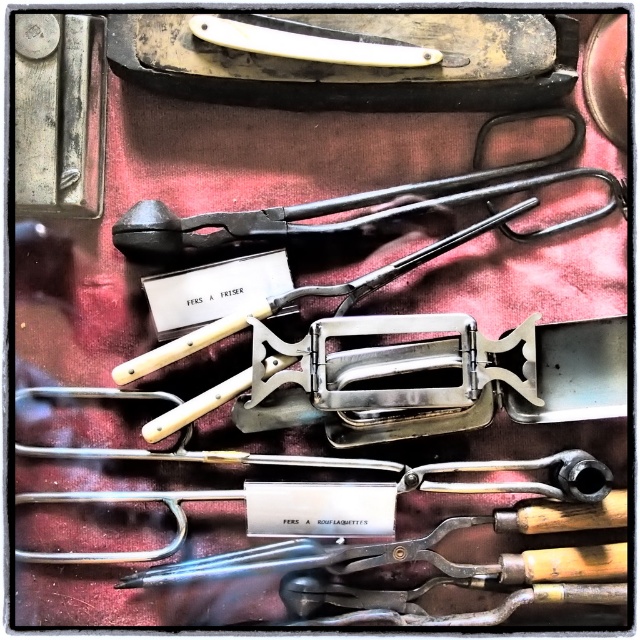
Question: Does black matte tongs at upper center have a lesser width compared to metallic silver tool at center?

Choices:
 (A) yes
 (B) no

Answer: (B)

Question: Which object is closer to the camera taking this photo?

Choices:
 (A) black matte tongs at upper center
 (B) metallic silver tool at center

Answer: (A)

Question: Is black matte tongs at upper center below white plastic straight razor at upper center?

Choices:
 (A) yes
 (B) no

Answer: (A)

Question: Can you confirm if white plastic straight razor at upper center is smaller than metallic silver tool at center?

Choices:
 (A) no
 (B) yes

Answer: (B)

Question: Considering the real-world distances, which object is farthest from the metallic silver tool at center?

Choices:
 (A) white plastic straight razor at upper center
 (B) black matte tongs at upper center

Answer: (A)

Question: Which object is positioned closest to the black matte tongs at upper center?

Choices:
 (A) white plastic straight razor at upper center
 (B) metallic silver tool at center

Answer: (B)